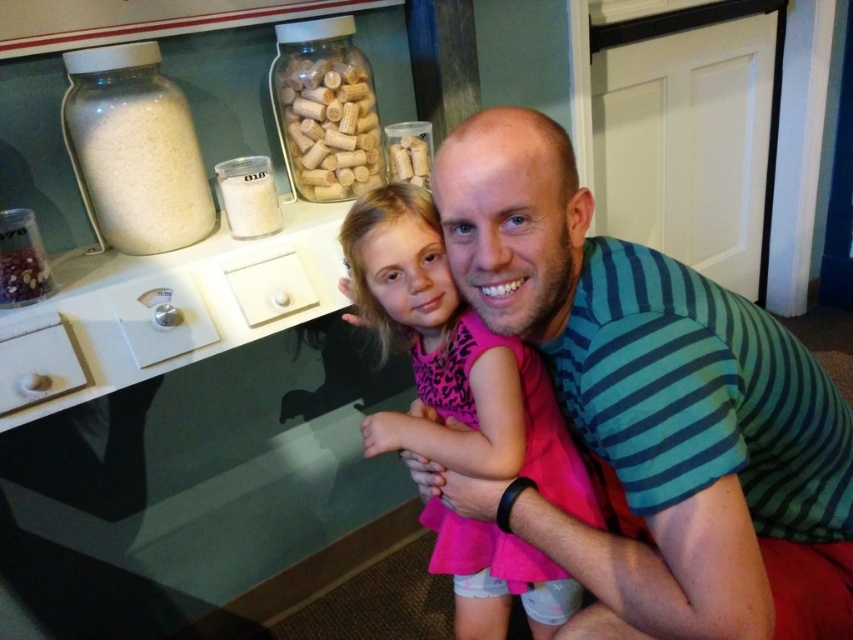
You are a customer at a store and want to examine the wooden corks at upper center and the shiny metallic beads at left in the display case. Which of these items is closer to you?

The wooden corks at upper center are closer to you because they are positioned further to the viewer than the shiny metallic beads at left.

You are a customer looking at the display case. You want to pick up the wooden corks at upper center and the shiny metallic beads at left. Which object is located higher in the display case?

The wooden corks at upper center are positioned over the shiny metallic beads at left, so they are higher.